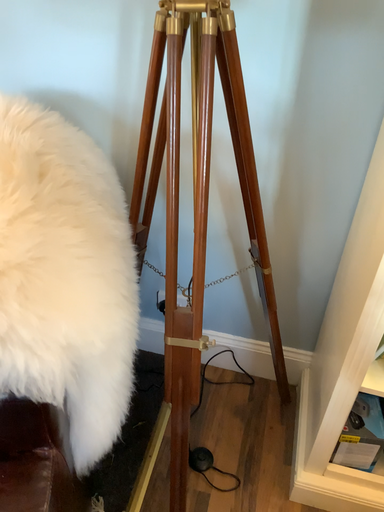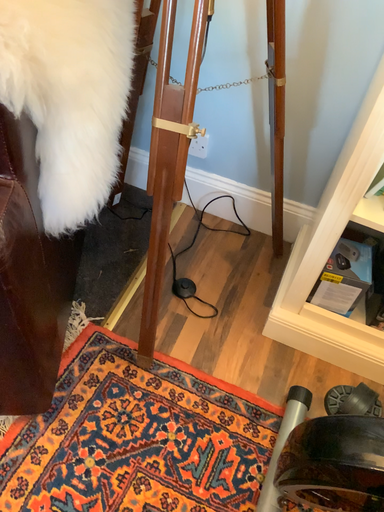
Question: How did the camera likely rotate when shooting the video?

Choices:
 (A) rotated upward
 (B) rotated downward

Answer: (B)